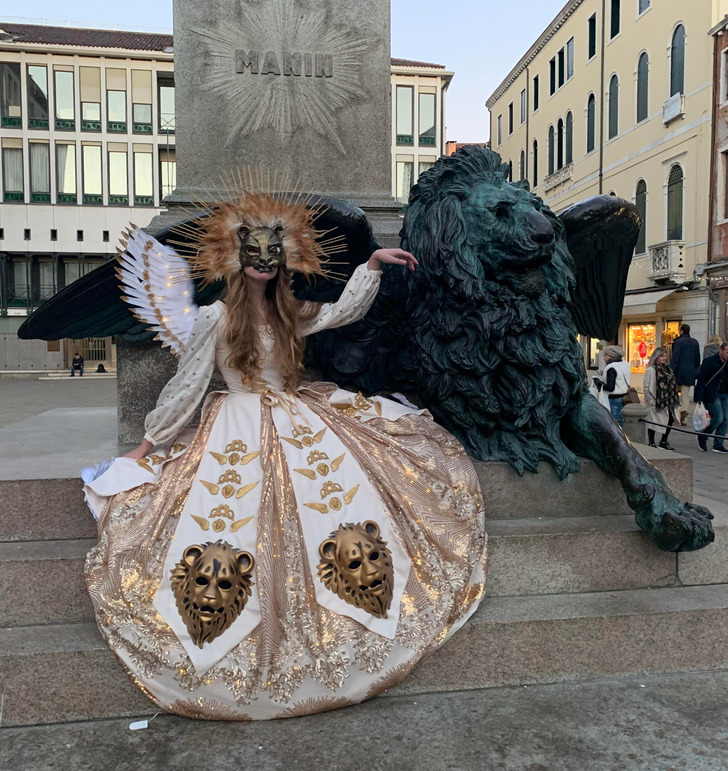
The image size is (728, 771). Identify the location of concrete pillar. (355, 98).